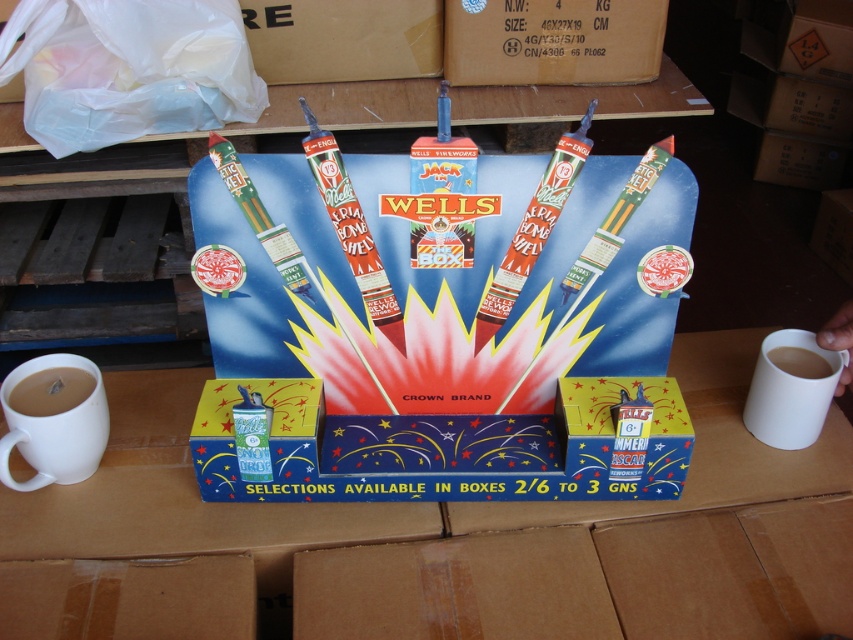
Which is more to the right, white matte mug at lower left or white ceramic mug at right?

From the viewer's perspective, white ceramic mug at right appears more on the right side.

Between point (65, 396) and point (805, 348), which one is positioned in front?

Point (65, 396) is in front.

I want to click on white matte mug at lower left, so click(51, 390).

Who is lower down, cardboard box at center or white matte mug at right?

Positioned lower is cardboard box at center.

From the picture: Who is more forward, (840, 531) or (763, 346)?

Point (840, 531) is in front.

Where is `cardboard box at center`? This screenshot has height=640, width=853. cardboard box at center is located at coordinates (422, 532).

Based on the photo, is cardboard box at center positioned behind white matte mug at left?

No, it is in front of white matte mug at left.

Between cardboard box at center and white matte mug at left, which one has less height?

Standing shorter between the two is white matte mug at left.

Is point (80, 536) positioned after point (55, 369)?

No, it is in front of (55, 369).

Where is `cardboard box at center`? This screenshot has height=640, width=853. cardboard box at center is located at coordinates (422, 532).